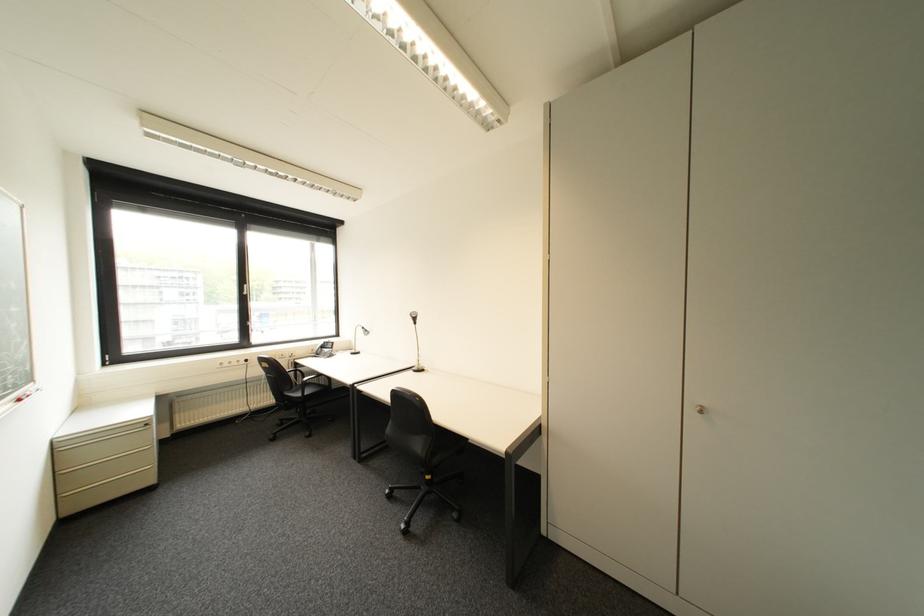
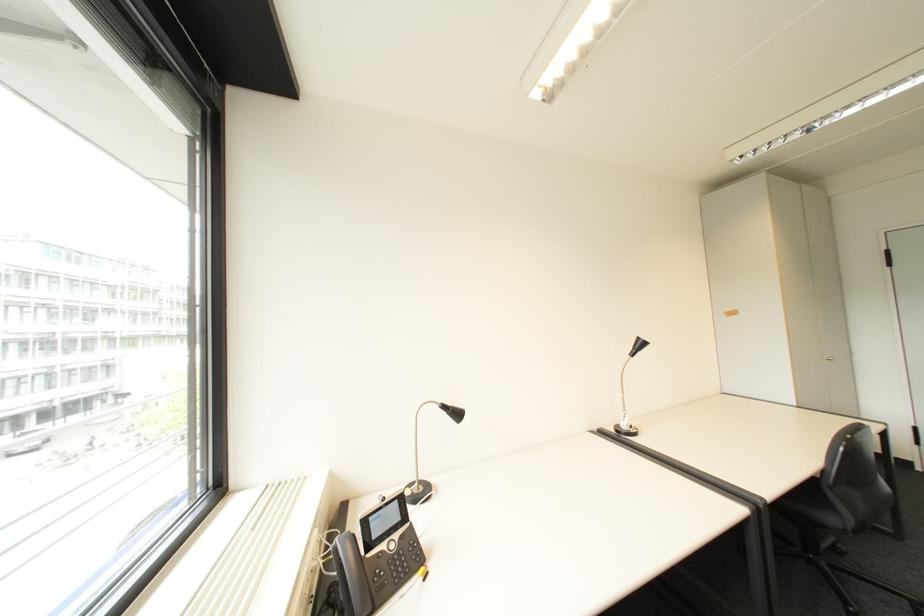
Locate, in the second image, the point that corresponds to (x=372, y=329) in the first image.

(455, 407)